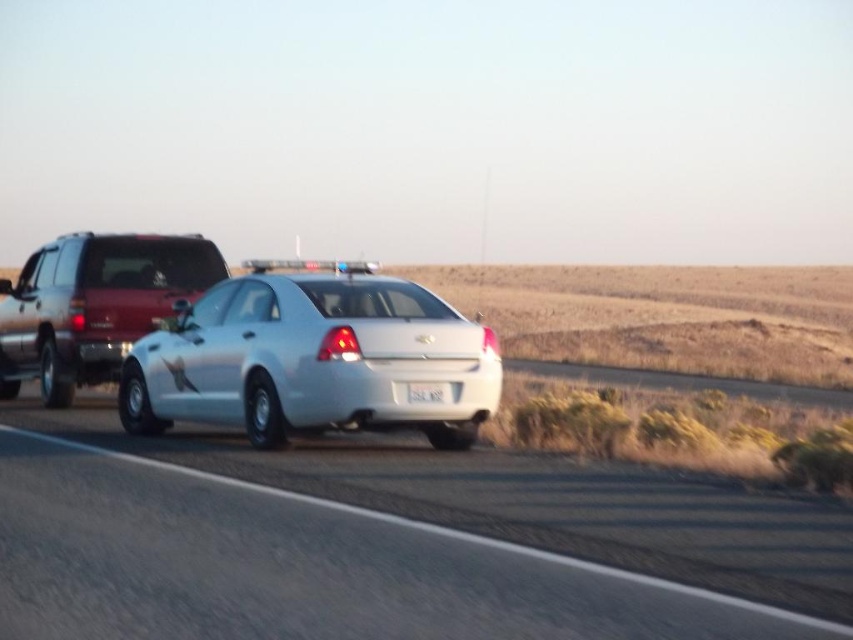
You are a driver approaching the white glossy car at center and the white glossy sedan at center on the highway. Based on their positions, which vehicle is closer to the road shoulder?

The white glossy car at center is closer to the road shoulder because it is positioned below the white glossy sedan at center, indicating it is lower in the frame and thus nearer to the shoulder area.

Based on the photo, you are a driver approaching the white sedan with brake lights on. You see a point at coordinates (357, 561). Is this point located on the white sedan?

Yes, the point at (357, 561) is on the white glossy car at center, which is the white sedan with brake lights on.

You are a pedestrian standing at the point marked as point (221, 634). You want to cross the highway to reach the other side. Considering the white sedan on the left is stopped with its brake lights on, is the distance from your current position to the sedan sufficient to safely wait until traffic allows crossing?

The distance between point (221, 634) and the white sedan on the left is 4.56 meters. Since the sedan is stopped with its brake lights on, this distance should be sufficient to safely wait until it is safe to cross the highway.